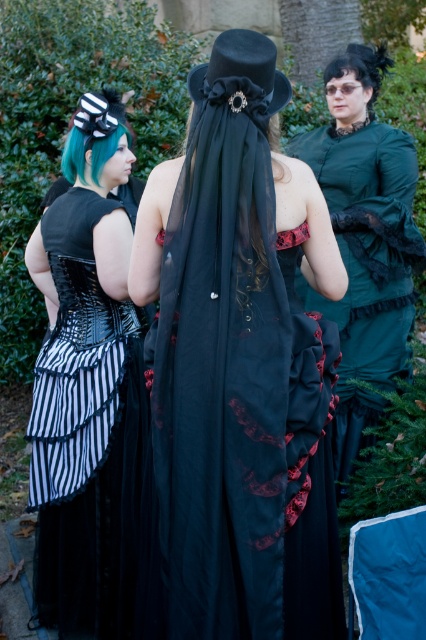
Question: Is matte black veil at center bigger than velvet green dress at center?

Choices:
 (A) no
 (B) yes

Answer: (A)

Question: Can you confirm if black striped fabric dress at left is bigger than velvet green dress at center?

Choices:
 (A) no
 (B) yes

Answer: (A)

Question: Estimate the real-world distances between objects in this image. Which object is farther from the velvet green dress at center?

Choices:
 (A) black striped fabric dress at left
 (B) matte black veil at center

Answer: (B)

Question: Which object is closer to the camera taking this photo?

Choices:
 (A) black striped fabric dress at left
 (B) velvet green dress at center
 (C) matte black veil at center

Answer: (C)

Question: Does matte black veil at center appear on the left side of black striped fabric dress at left?

Choices:
 (A) no
 (B) yes

Answer: (A)

Question: Among these points, which one is farthest from the camera?

Choices:
 (A) (195, 289)
 (B) (134, 538)
 (C) (394, 195)

Answer: (C)